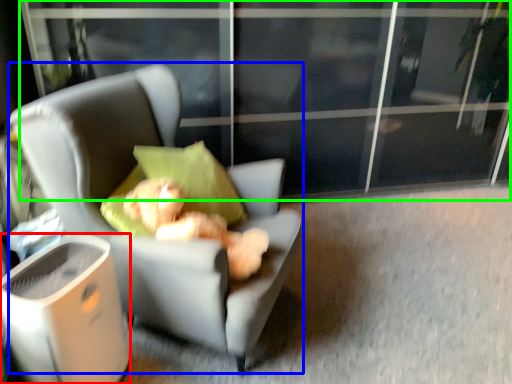
Question: Estimate the real-world distances between objects in this image. Which object is closer to trash bin/can (highlighted by a red box), chair (highlighted by a blue box) or screen door (highlighted by a green box)?

Choices:
 (A) chair
 (B) screen door

Answer: (A)